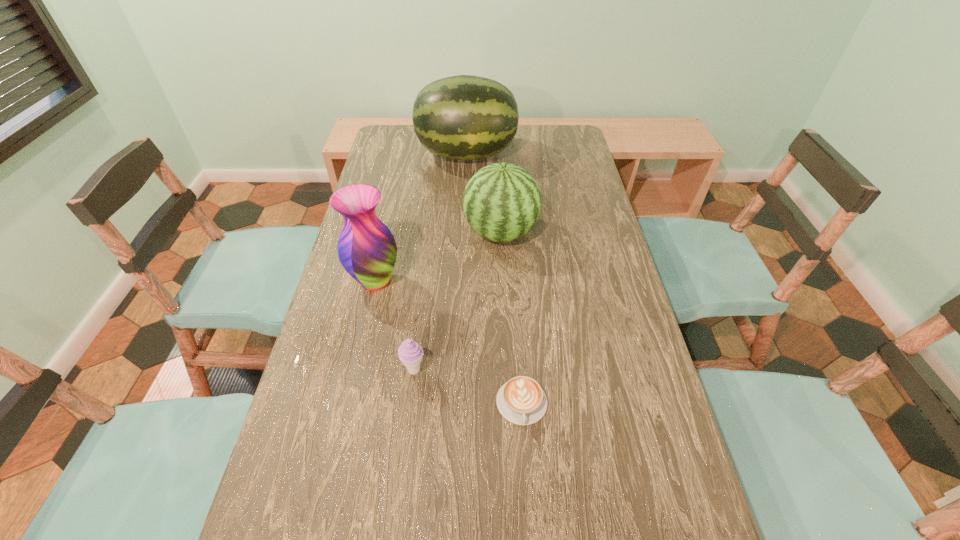
Where is `object that is at the far edge`? This screenshot has height=540, width=960. object that is at the far edge is located at coordinates (464, 117).

Where is `watermelon present at the left edge`? This screenshot has height=540, width=960. watermelon present at the left edge is located at coordinates 464,117.

This screenshot has height=540, width=960. Identify the location of vase at the left edge. (367, 250).

This screenshot has height=540, width=960. I want to click on object located in the far left corner section of the desktop, so click(464, 117).

In the image, there is a desktop. Find the location of `free space at the far edge`. free space at the far edge is located at coordinates (531, 146).

Locate an element on the screen. The image size is (960, 540). vacant area at the left edge of the desktop is located at coordinates (350, 369).

Find the location of a particular element. The height and width of the screenshot is (540, 960). vacant space at the right edge is located at coordinates (555, 188).

You are a GUI agent. You are given a task and a screenshot of the screen. Output one action in this format:
    pyautogui.click(x=<x>, y=<y>)
    Task: Click on the vacant space at the far left corner
    This screenshot has height=540, width=960.
    Given the screenshot: What is the action you would take?
    pyautogui.click(x=390, y=142)

In the image, there is a desktop. Where is `free space at the far right corner`? free space at the far right corner is located at coordinates (580, 141).

Locate an element on the screen. The image size is (960, 540). free spot between the fourth tallest object and the fourth nearest object is located at coordinates (457, 302).